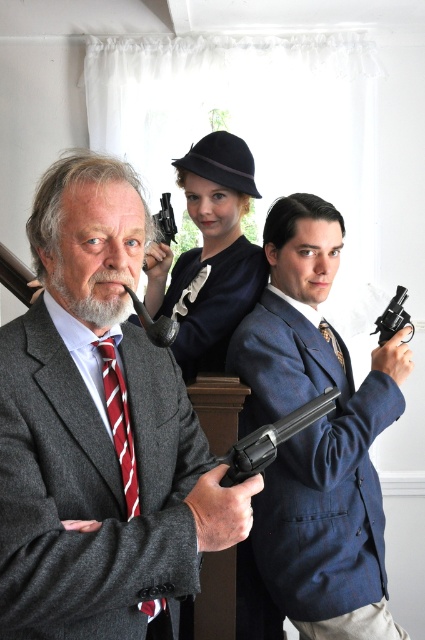
You are a detective examining the scene. You notice two revolvers in the image. The first is the black matte revolver at center and the second is the black metal revolver at right. Based on their positions, which revolver is closer to the left side of the image?

The black matte revolver at center is closer to the left side of the image because it is positioned to the left of the black metal revolver at right.

You are a photographer setting up a shot of the scene described. You want to ensure the black matte revolver at center is in focus while keeping the background slightly blurred. Given the revolver is 3.49 feet from the camera, what adjustment should you make to the camera settings to achieve this effect?

To achieve a blurred background with the black matte revolver at center in focus, set the camera to a wide aperture to create a shallow depth of field. Since the revolver is 3.49 feet away, adjusting the focus distance to that measurement will ensure it remains sharp while the background softens.

You are a costume designer preparing for a play. You need to ensure that the black metal revolver at right and the red striped tie at center are visible to the audience. Given that the stage has limited space, which object should be placed closer to the front to ensure both are visible?

The black metal revolver at right should be placed closer to the front because it is taller than the red striped tie at center, ensuring both objects are visible to the audience.